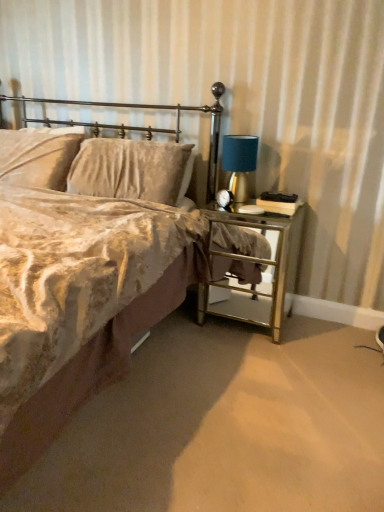
In order to face velvet beige pillow at upper left, the 2th pillow when ordered from right to left, should I rotate leftwards or rightwards?

Turn left by 19.641 degrees to look at velvet beige pillow at upper left, the 2th pillow when ordered from right to left.

Image resolution: width=384 pixels, height=512 pixels. Describe the element at coordinates (129, 169) in the screenshot. I see `velvet beige pillow at upper left, the 1th pillow in the right-to-left sequence` at that location.

What do you see at coordinates (142, 127) in the screenshot? Image resolution: width=384 pixels, height=512 pixels. I see `metallic gold headboard at upper left` at bounding box center [142, 127].

Measure the distance between metallic gold headboard at upper left and camera.

The distance of metallic gold headboard at upper left from camera is 2.23 meters.

This screenshot has height=512, width=384. Find the location of `gold mirrored nightstand at right`. gold mirrored nightstand at right is located at coordinates (264, 271).

Is metallic gold headboard at upper left oriented towards velvet beige pillow at upper left, which appears as the first pillow when viewed from the left?

No, metallic gold headboard at upper left is not facing towards velvet beige pillow at upper left, which appears as the first pillow when viewed from the left.

Is metallic gold headboard at upper left thinner than velvet beige pillow at upper left, which appears as the first pillow when viewed from the left?

No.

Is metallic gold headboard at upper left bigger or smaller than velvet beige pillow at upper left, the 2th pillow when ordered from right to left?

Clearly, metallic gold headboard at upper left is larger in size than velvet beige pillow at upper left, the 2th pillow when ordered from right to left.

Is gold mirrored nightstand at right turned away from blue fabric lampshade at right?

No, gold mirrored nightstand at right's orientation is not away from blue fabric lampshade at right.

Is gold mirrored nightstand at right not near blue fabric lampshade at right?

gold mirrored nightstand at right is actually quite close to blue fabric lampshade at right.

Between point (230, 279) and point (253, 142), which one is positioned behind?

The point (230, 279) is behind.

How many degrees apart are the facing directions of gold mirrored nightstand at right and blue fabric lampshade at right?

Result: 0.000322 degrees separate the facing orientations of gold mirrored nightstand at right and blue fabric lampshade at right.

Does metallic gold headboard at upper left have a greater height compared to blue fabric lampshade at right?

Indeed, metallic gold headboard at upper left has a greater height compared to blue fabric lampshade at right.

From a real-world perspective, who is located higher, metallic gold headboard at upper left or blue fabric lampshade at right?

blue fabric lampshade at right, from a real-world perspective.

Is metallic gold headboard at upper left turned away from blue fabric lampshade at right?

metallic gold headboard at upper left does not have its back to blue fabric lampshade at right.

Is metallic gold headboard at upper left in front of or behind blue fabric lampshade at right in the image?

Visually, metallic gold headboard at upper left is located in front of blue fabric lampshade at right.

Visually, is velvet beige pillow at upper left, the 1th pillow in the right-to-left sequence, positioned to the left or to the right of gold mirrored nightstand at right?

In the image, velvet beige pillow at upper left, the 1th pillow in the right-to-left sequence, appears on the left side of gold mirrored nightstand at right.

Which of these two, velvet beige pillow at upper left, which is counted as the second pillow, starting from the left, or gold mirrored nightstand at right, is bigger?

Bigger between the two is gold mirrored nightstand at right.

In terms of width, does velvet beige pillow at upper left, the 1th pillow in the right-to-left sequence, look wider or thinner when compared to gold mirrored nightstand at right?

velvet beige pillow at upper left, the 1th pillow in the right-to-left sequence, is thinner than gold mirrored nightstand at right.

Is blue fabric lampshade at right in front of velvet beige bed at center?

No, blue fabric lampshade at right is behind velvet beige bed at center.

In the scene shown: Would you consider blue fabric lampshade at right to be distant from velvet beige bed at center?

No.

Can velvet beige bed at center be found inside blue fabric lampshade at right?

No, velvet beige bed at center is not inside blue fabric lampshade at right.

Considering the relative positions of blue fabric lampshade at right and velvet beige bed at center in the image provided, is blue fabric lampshade at right to the right of velvet beige bed at center from the viewer's perspective?

Correct, you'll find blue fabric lampshade at right to the right of velvet beige bed at center.

Looking at this image, considering the positions of objects velvet beige pillow at upper left, the 2th pillow when ordered from right to left, and velvet beige bed at center in the image provided, who is more to the right, velvet beige pillow at upper left, the 2th pillow when ordered from right to left, or velvet beige bed at center?

velvet beige bed at center.

Where is `bed located in front of the velvet beige pillow at upper left, which appears as the first pillow when viewed from the left`? The width and height of the screenshot is (384, 512). bed located in front of the velvet beige pillow at upper left, which appears as the first pillow when viewed from the left is located at coordinates (83, 301).

Considering the relative sizes of velvet beige pillow at upper left, the 2th pillow when ordered from right to left, and velvet beige bed at center in the image provided, is velvet beige pillow at upper left, the 2th pillow when ordered from right to left, taller than velvet beige bed at center?

Incorrect, the height of velvet beige pillow at upper left, the 2th pillow when ordered from right to left, is not larger of that of velvet beige bed at center.

Is velvet beige pillow at upper left, which is counted as the second pillow, starting from the left, facing towards blue fabric lampshade at right?

No, velvet beige pillow at upper left, which is counted as the second pillow, starting from the left, is not oriented towards blue fabric lampshade at right.

From a real-world perspective, between velvet beige pillow at upper left, the 1th pillow in the right-to-left sequence, and blue fabric lampshade at right, who is vertically lower?

velvet beige pillow at upper left, the 1th pillow in the right-to-left sequence, is physically lower.

Which point is more forward, (78, 155) or (248, 170)?

The point (248, 170) is closer.

Is velvet beige pillow at upper left, the 1th pillow in the right-to-left sequence, not within blue fabric lampshade at right?

velvet beige pillow at upper left, the 1th pillow in the right-to-left sequence, lies outside blue fabric lampshade at right's area.

Identify the location of pillow to the left of metallic gold headboard at upper left. The image size is (384, 512). (37, 157).

At what (x,y) coordinates should I click in order to perform the action: click on bedside lamp above the gold mirrored nightstand at right (from a real-world perspective). Please return your answer as a coordinate pair (x, y). The width and height of the screenshot is (384, 512). Looking at the image, I should click on (239, 163).

Based on their spatial positions, is velvet beige pillow at upper left, which is counted as the second pillow, starting from the left, or blue fabric lampshade at right further from velvet beige pillow at upper left, the 2th pillow when ordered from right to left?

Based on the image, blue fabric lampshade at right appears to be further to velvet beige pillow at upper left, the 2th pillow when ordered from right to left.

When comparing their distances from velvet beige pillow at upper left, the 1th pillow in the right-to-left sequence, does velvet beige bed at center or gold mirrored nightstand at right seem further?

Among the two, gold mirrored nightstand at right is located further to velvet beige pillow at upper left, the 1th pillow in the right-to-left sequence.

Looking at the image, which one is located closer to velvet beige bed at center, velvet beige pillow at upper left, the 1th pillow in the right-to-left sequence, or metallic gold headboard at upper left?

velvet beige pillow at upper left, the 1th pillow in the right-to-left sequence, lies closer to velvet beige bed at center than the other object.

Considering their positions, is velvet beige pillow at upper left, which is counted as the second pillow, starting from the left, positioned closer to metallic gold headboard at upper left than blue fabric lampshade at right?

velvet beige pillow at upper left, which is counted as the second pillow, starting from the left, is closer to metallic gold headboard at upper left.

Estimate the real-world distances between objects in this image. Which object is closer to velvet beige pillow at upper left, which appears as the first pillow when viewed from the left, gold mirrored nightstand at right or velvet beige pillow at upper left, which is counted as the second pillow, starting from the left?

velvet beige pillow at upper left, which is counted as the second pillow, starting from the left, is closer to velvet beige pillow at upper left, which appears as the first pillow when viewed from the left.

When comparing their distances from metallic gold headboard at upper left, does blue fabric lampshade at right or velvet beige pillow at upper left, the 2th pillow when ordered from right to left, seem further?

blue fabric lampshade at right.

When comparing their distances from velvet beige bed at center, does velvet beige pillow at upper left, which appears as the first pillow when viewed from the left, or blue fabric lampshade at right seem further?

The object further to velvet beige bed at center is blue fabric lampshade at right.

When comparing their distances from metallic gold headboard at upper left, does gold mirrored nightstand at right or velvet beige bed at center seem closer?

The object closer to metallic gold headboard at upper left is gold mirrored nightstand at right.

The width and height of the screenshot is (384, 512). Identify the location of bedside lamp between velvet beige bed at center and velvet beige pillow at upper left, which is counted as the second pillow, starting from the left, from front to back. (239, 163).

Identify the location of nightstand between velvet beige bed at center and velvet beige pillow at upper left, the 1th pillow in the right-to-left sequence, from front to back. The height and width of the screenshot is (512, 384). (264, 271).

Where is `headboard between velvet beige bed at center and velvet beige pillow at upper left, the 2th pillow when ordered from right to left, from front to back`? This screenshot has height=512, width=384. headboard between velvet beige bed at center and velvet beige pillow at upper left, the 2th pillow when ordered from right to left, from front to back is located at coordinates (142, 127).

You are a GUI agent. You are given a task and a screenshot of the screen. Output one action in this format:
    pyautogui.click(x=<x>, y=<y>)
    Task: Click on the bedside lamp between velvet beige pillow at upper left, the 2th pillow when ordered from right to left, and gold mirrored nightstand at right
    This screenshot has height=512, width=384.
    Given the screenshot: What is the action you would take?
    pyautogui.click(x=239, y=163)